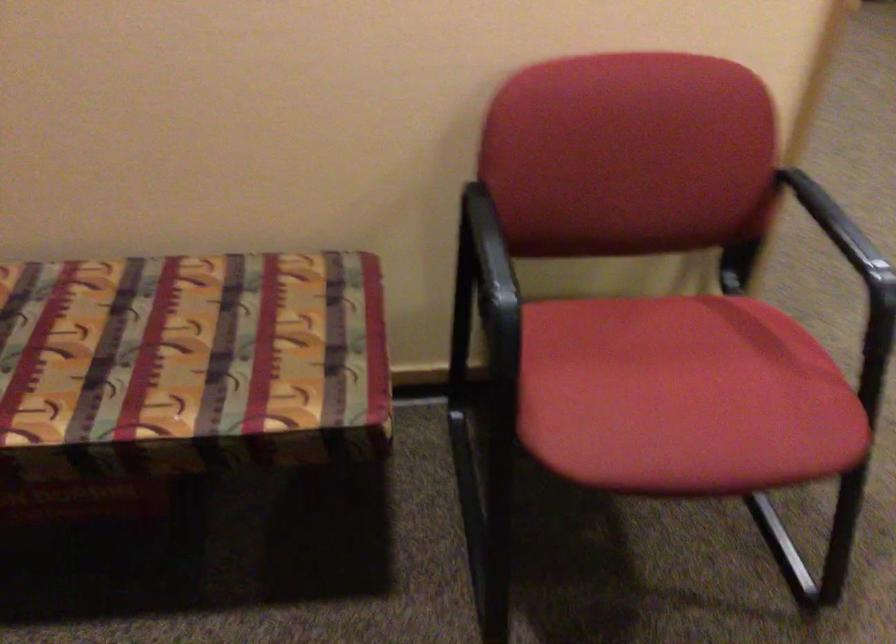
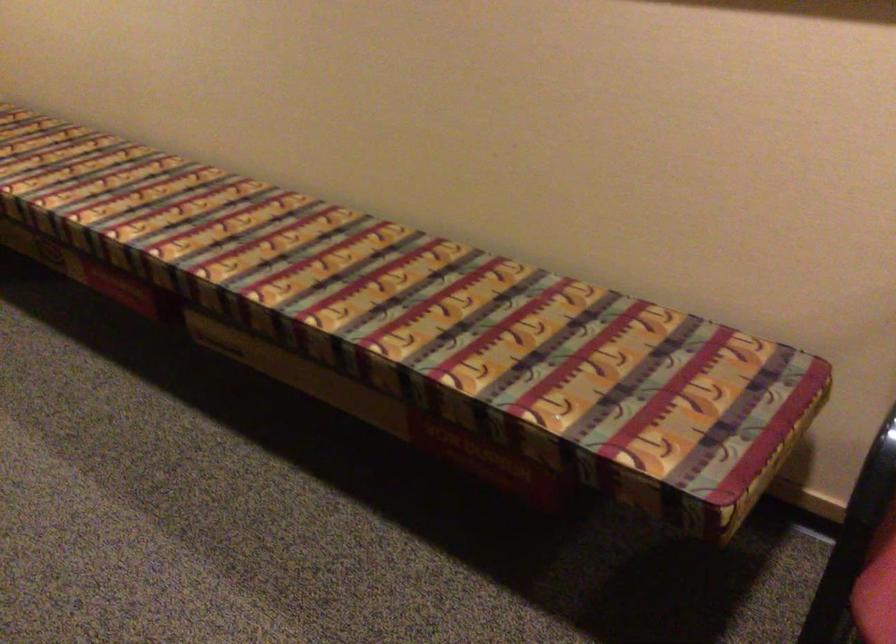
Question: The images are taken continuously from a first-person perspective. In which direction is your viewpoint rotating?

Choices:
 (A) Left
 (B) Right
 (C) Up
 (D) Down

Answer: (A)